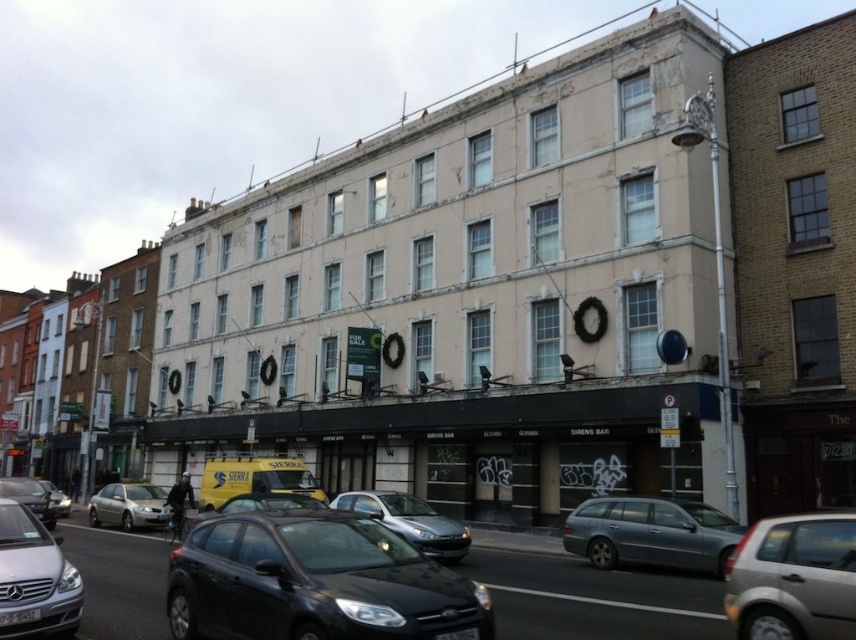
You are standing on the sidewalk in front of the white textured building at center. You want to take a photo of the building with your smartphone, which has a maximum focus range of 25 meters. Will your phone be able to focus on the building?

The white textured building at center is 25.98 meters away from the viewer. Since the phone has a maximum focus range of 25 meters, it cannot focus on the building because it is slightly beyond the maximum range.

You are a delivery driver who needs to park your silver metallic car at lower left near the building. The parking spot is designed to fit vehicles the size of the satin silver estate at center. Will your car fit in the parking spot?

The satin silver estate at center has a smaller size compared to the silver metallic car at lower left. Since the parking spot is designed for the smaller satin silver estate at center, the silver metallic car at lower left will not fit in the parking spot.